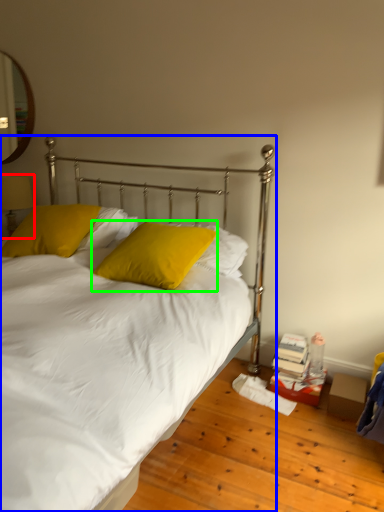
Question: Based on their relative distances, which object is farther from table lamp (highlighted by a red box)? Choose from bed (highlighted by a blue box) and pillow (highlighted by a green box).

Choices:
 (A) bed
 (B) pillow

Answer: (B)